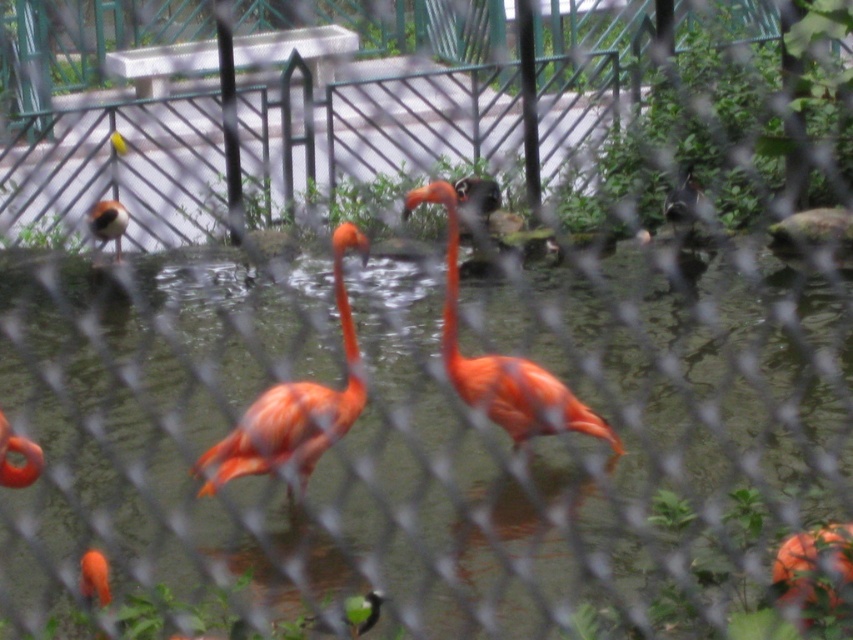
Question: Does matte orange flamingo at center appear on the right side of brown speckled bird at upper left?

Choices:
 (A) no
 (B) yes

Answer: (B)

Question: Which object is the closest to the orange matte flamingo at center?

Choices:
 (A) metal chain-link fence at center
 (B) matte orange flamingo at center

Answer: (B)

Question: Which point is farther to the camera?

Choices:
 (A) (241, 449)
 (B) (466, 141)

Answer: (B)

Question: Does metal chain-link fence at center appear on the left side of matte orange flamingo at center?

Choices:
 (A) yes
 (B) no

Answer: (B)

Question: Does matte orange flamingo at center appear over brown speckled bird at upper left?

Choices:
 (A) no
 (B) yes

Answer: (A)

Question: Which is farther from the metal chain-link fence at center?

Choices:
 (A) matte orange flamingo at center
 (B) orange matte flamingo at center

Answer: (B)